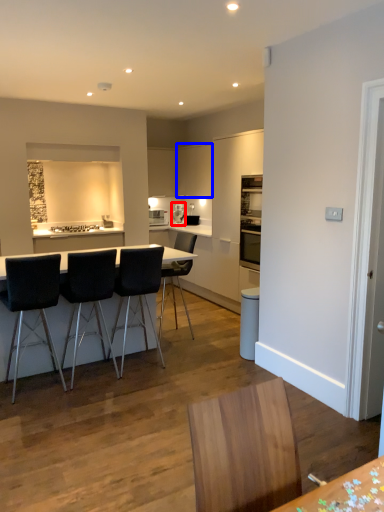
Question: Which point is closer to the camera, coffee machine (highlighted by a red box) or cabinetry (highlighted by a blue box)?

Choices:
 (A) coffee machine
 (B) cabinetry

Answer: (B)